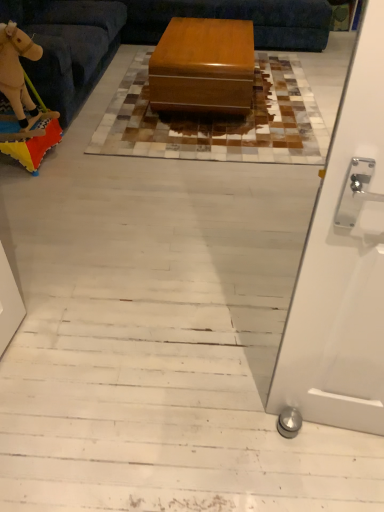
Question: Is glossy wood table at center wider or thinner than leather-like brown mat at center?

Choices:
 (A) thin
 (B) wide

Answer: (A)

Question: Would you say glossy wood table at center is inside or outside leather-like brown mat at center?

Choices:
 (A) inside
 (B) outside

Answer: (B)

Question: Which object is the farthest from the light brown plush toy at left?

Choices:
 (A) glossy wood table at center
 (B) wooden toy horse at left
 (C) leather-like brown mat at center
 (D) velvety beige rocking horse at left
 (E) velvet blue couch at upper center

Answer: (A)

Question: Estimate the real-world distances between objects in this image. Which object is closer to the glossy wood table at center?

Choices:
 (A) leather-like brown mat at center
 (B) velvety beige rocking horse at left
 (C) light brown plush toy at left
 (D) wooden toy horse at left
 (E) velvet blue couch at upper center

Answer: (A)